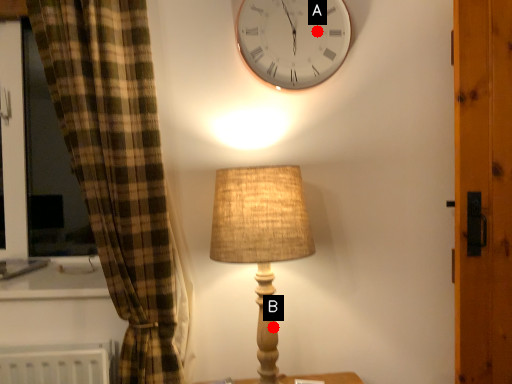
Question: Two points are circled on the image, labeled by A and B beside each circle. Among these points, which one is nearest to the camera?

Choices:
 (A) A is closer
 (B) B is closer

Answer: (B)